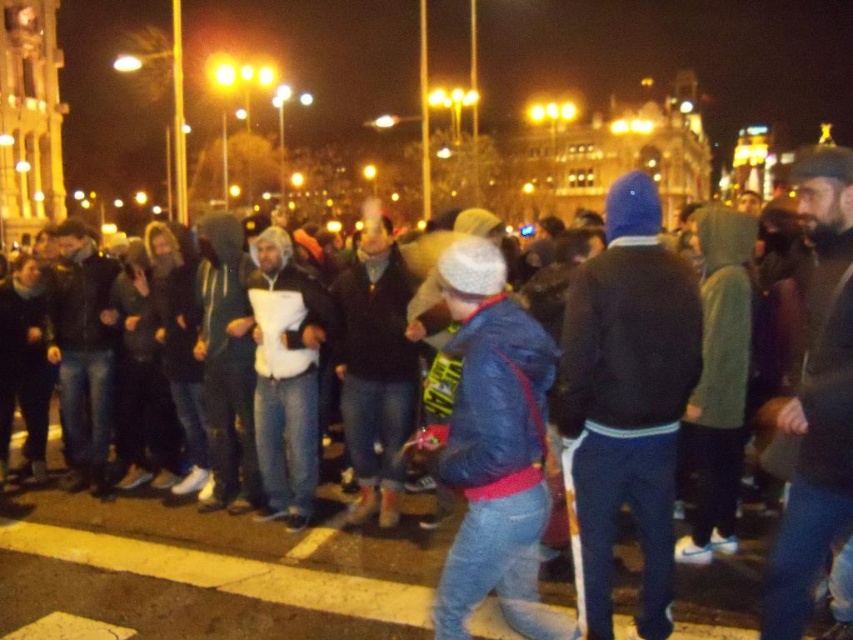
You are standing in the crowd at the nighttime event. You notice two points in the scene, one at coordinate point (482, 444) and another at point (260, 371). Which point is nearer to you?

Point (482, 444) is closer to the viewer than point (260, 371).

Looking at this image, you are a photographer standing in the crowd and want to capture a photo of both the blue leather jacket at center and the white matte hoodie at center in the same frame. Based on their positions, is there enough space between them to include both in your shot?

The blue leather jacket at center might be wider than white matte hoodie at center, so there may not be enough space between them to include both in the same frame if they are positioned closely together.

You are a photographer standing at the edge of the crowd. You want to take a photo that includes both the dark brown sweater at center and the blue leather jacket at center. Given that your camera has a maximum focus range of 4 meters, will you be able to capture both subjects in focus without moving closer?

The distance between the dark brown sweater at center and the blue leather jacket at center is 4.28 meters. Since the camera can only focus up to 4 meters, the subjects are slightly out of the camera range. You might need to move closer to ensure both are in focus.